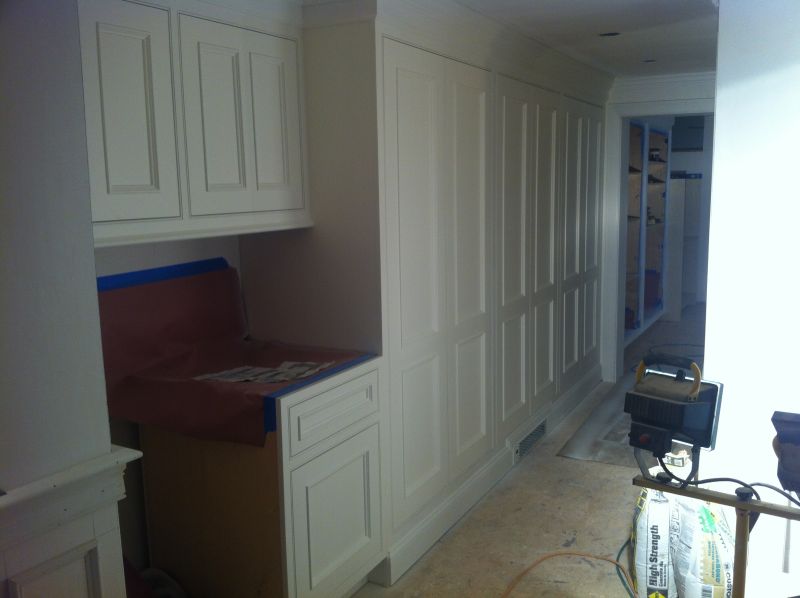
At what (x,y) coordinates should I click in order to perform the action: click on top right cupboard. Please return your answer as a coordinate pair (x, y). This screenshot has width=800, height=598. Looking at the image, I should click on (234, 146).